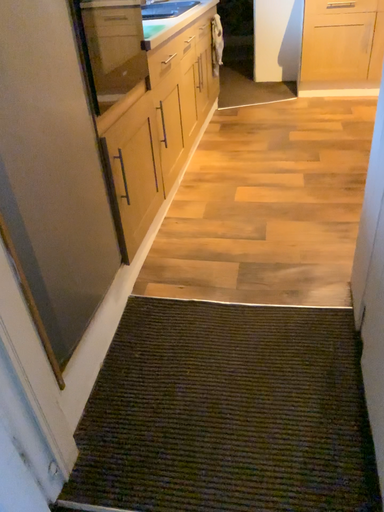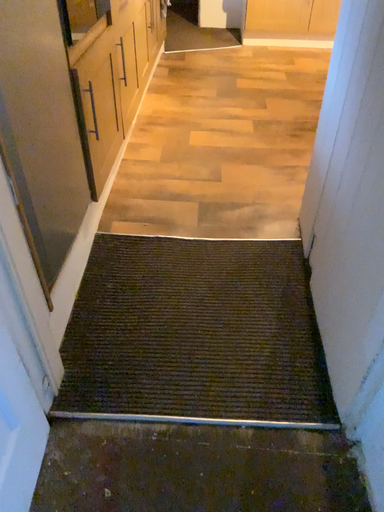
Question: How did the camera likely rotate when shooting the video?

Choices:
 (A) rotated left
 (B) rotated right

Answer: (B)